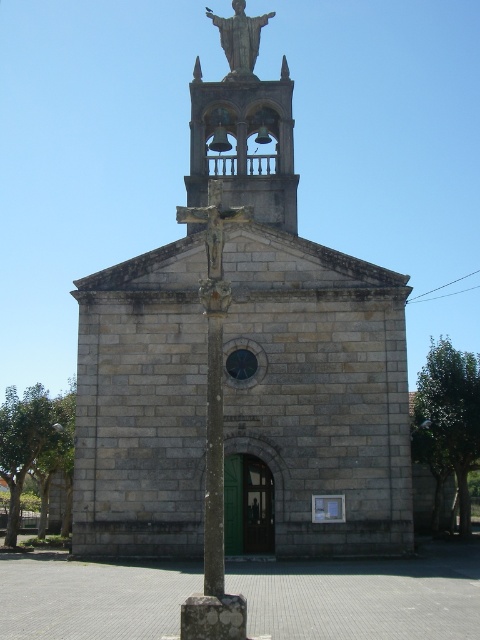
Looking at this image, you are standing in front of the gray stone church at center and the gold metallic statue at upper center. Which one is more to the left?

The gray stone church at center is more to the left than the gold metallic statue at upper center.

You are standing in front of the church and notice two points marked on the bell tower. The first point is at coordinates point (223, 134) and the second is at point (223, 29). Which point is closer to you?

Point (223, 134) is closer to the viewer than point (223, 29).

You are standing in front of the gray stone church at center and want to take a photo of the bronze bell tower at upper center. Since the church is in the way, will you need to move forward or backward to frame the bell tower without the church blocking it?

The gray stone church at center is much taller than the bronze bell tower at upper center. To avoid the church blocking the view of the bronze bell tower at upper center, you should move backward to get a wider angle that includes both structures without obstruction.